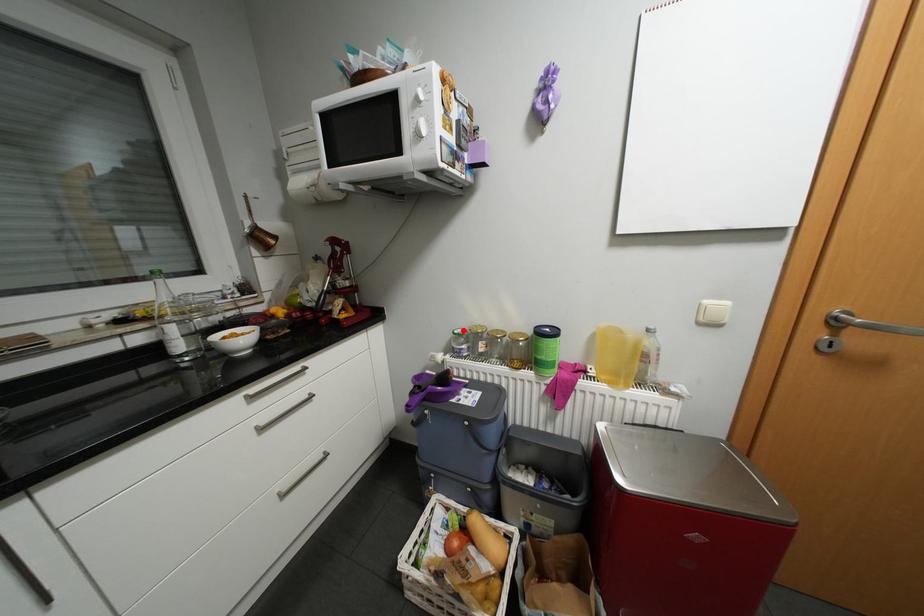
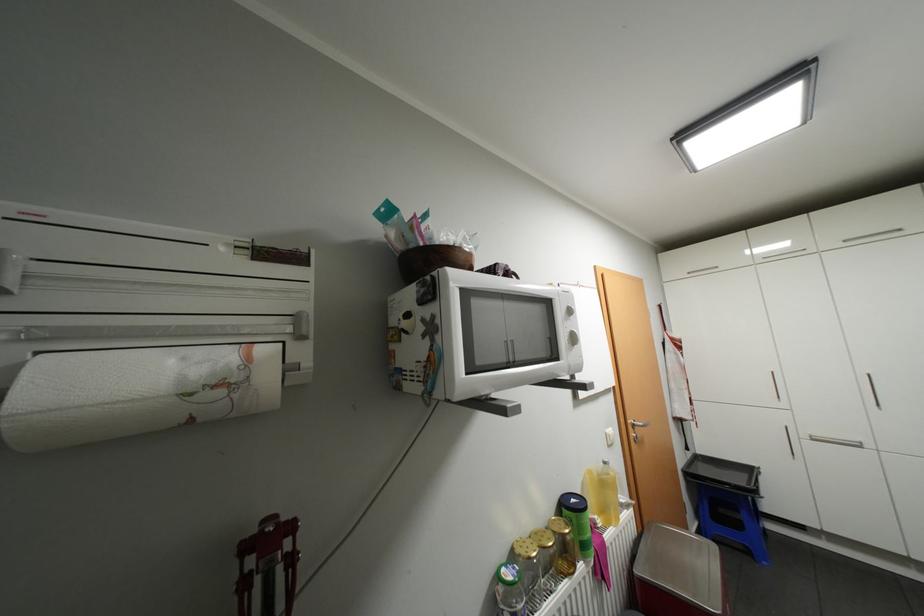
Find the pixel in the second image that matches the highlighted location in the first image.

(518, 576)